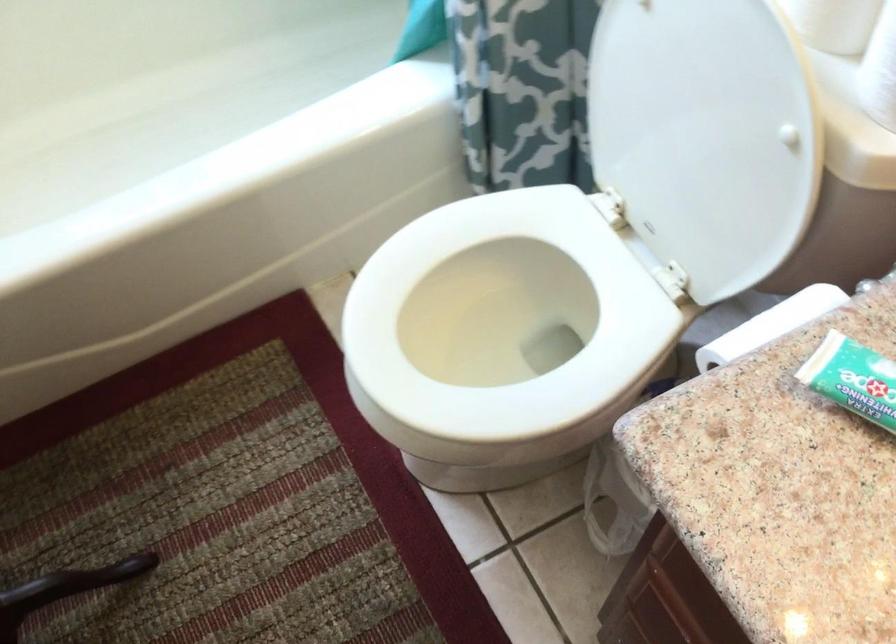
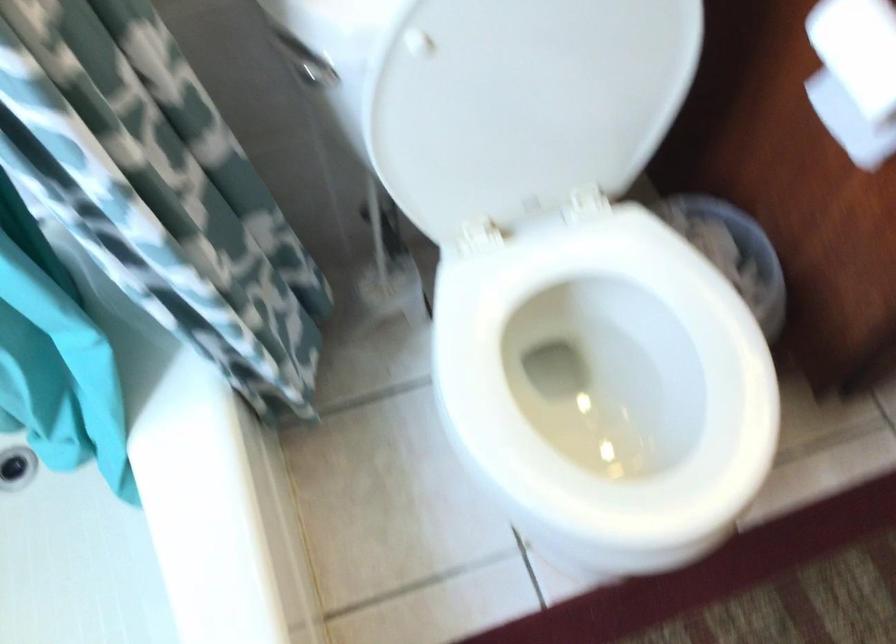
In the second image, find the point that corresponds to (683,126) in the first image.

(528, 93)